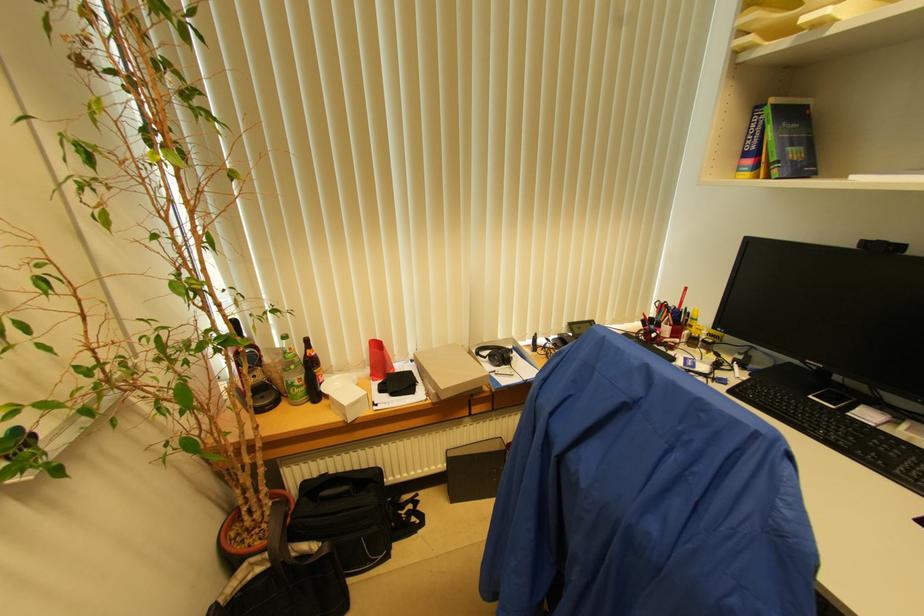
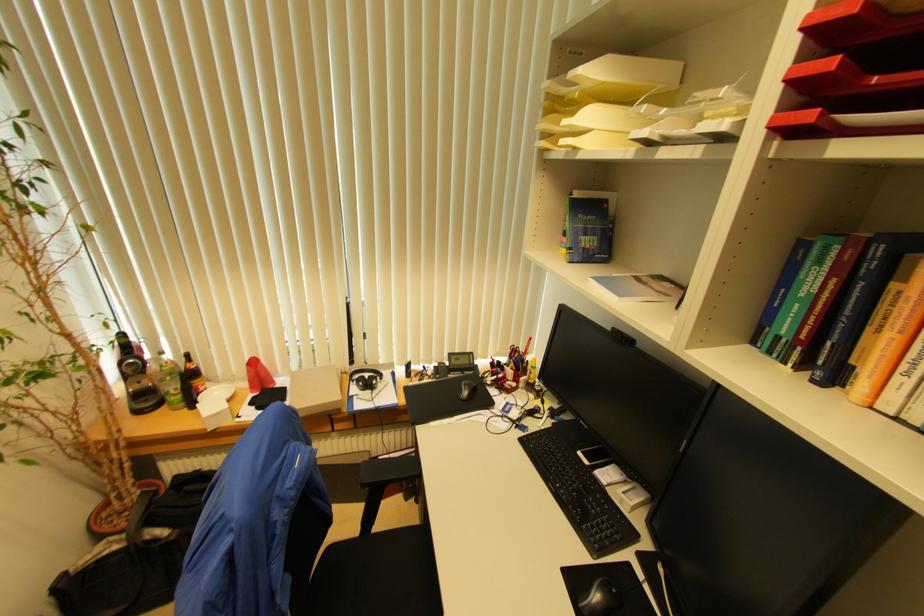
Question: Based on the continuous images, in which direction is the camera rotating? Reply with the corresponding letter.

Choices:
 (A) Left
 (B) Right
 (C) Up
 (D) Down

Answer: (D)